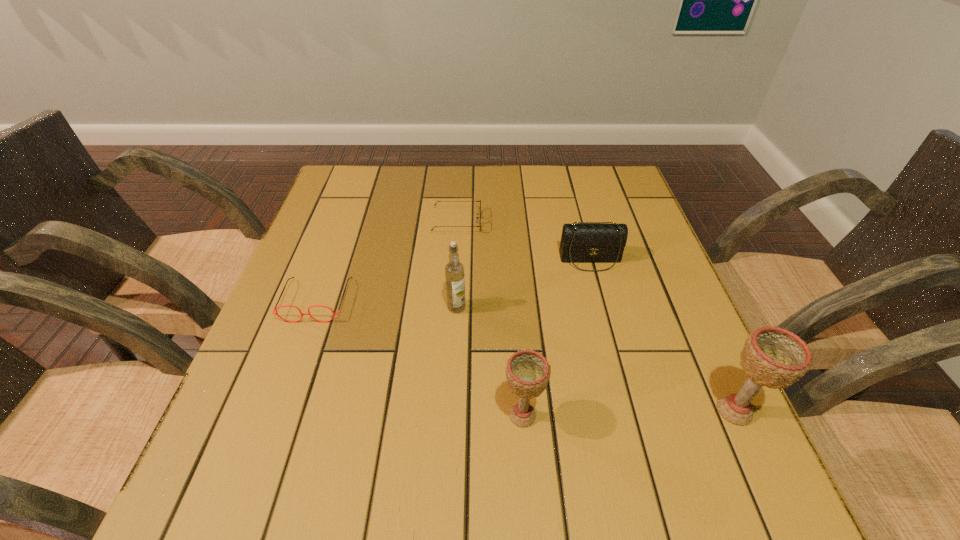
Please point a spot to add another chalice on the left. Please provide its 2D coordinates. Your answer should be formatted as a tuple, i.e. [(x, y)], where the tuple contains the x and y coordinates of a point satisfying the conditions above.

[(307, 420)]